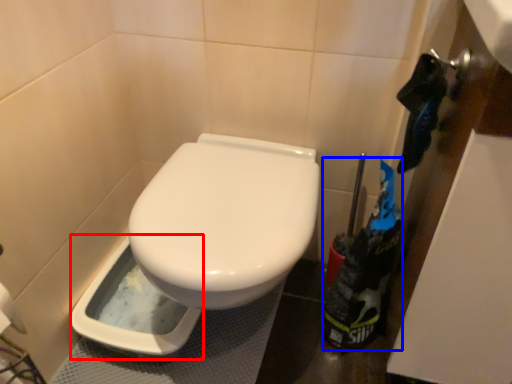
Question: Which point is closer to the camera, bidet (highlighted by a red box) or garbage (highlighted by a blue box)?

Choices:
 (A) bidet
 (B) garbage

Answer: (B)